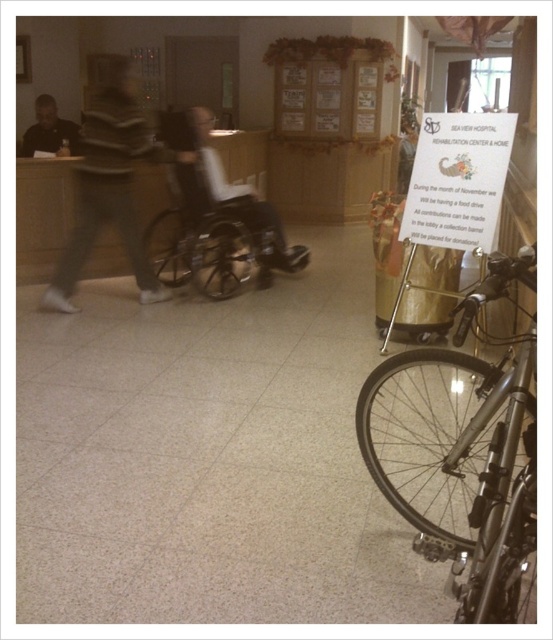
Question: Is shiny metallic bicycle at lower right above matte black wheelchair at center?

Choices:
 (A) yes
 (B) no

Answer: (B)

Question: Can you confirm if gray striped sweater at center is positioned to the left of matte black wheelchair at center?

Choices:
 (A) no
 (B) yes

Answer: (B)

Question: Among these objects, which one is farthest from the camera?

Choices:
 (A) matte black wheelchair at center
 (B) matte black shirt at upper left
 (C) shiny metallic bicycle at lower right

Answer: (B)

Question: Does shiny metallic bicycle at lower right lie behind matte black wheelchair at center?

Choices:
 (A) no
 (B) yes

Answer: (A)

Question: Which of the following is the farthest from the observer?

Choices:
 (A) (128, 115)
 (B) (237, 220)

Answer: (B)

Question: Among these points, which one is nearest to the camera?

Choices:
 (A) click(x=244, y=228)
 (B) click(x=106, y=68)
 (C) click(x=482, y=582)
 (D) click(x=263, y=212)

Answer: (C)